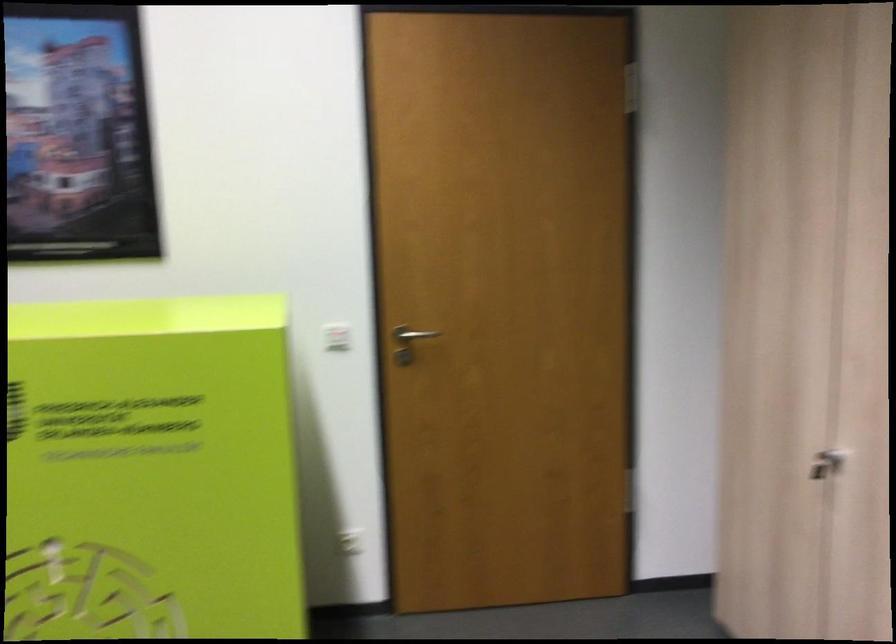
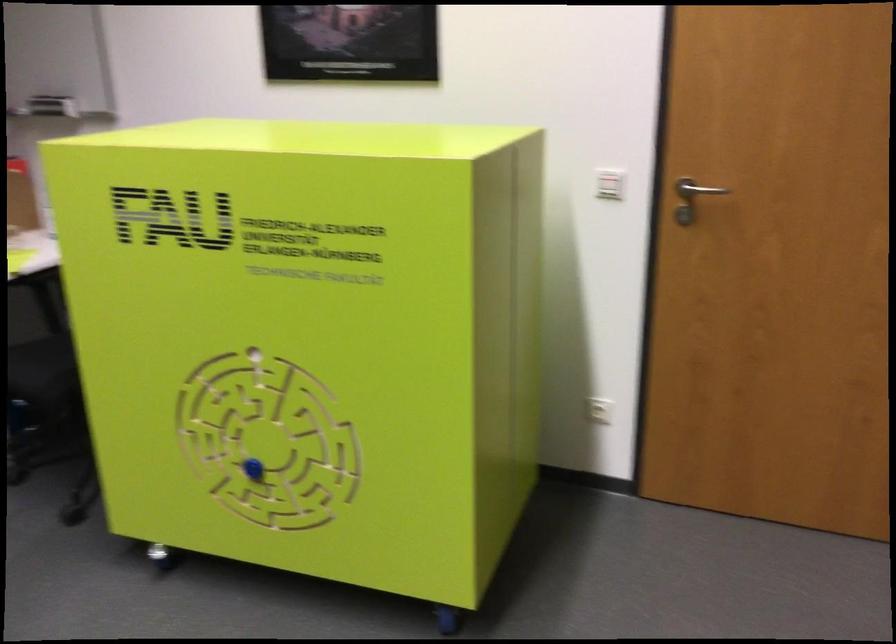
The point at (119, 514) is marked in the first image. Where is the corresponding point in the second image?

(309, 341)